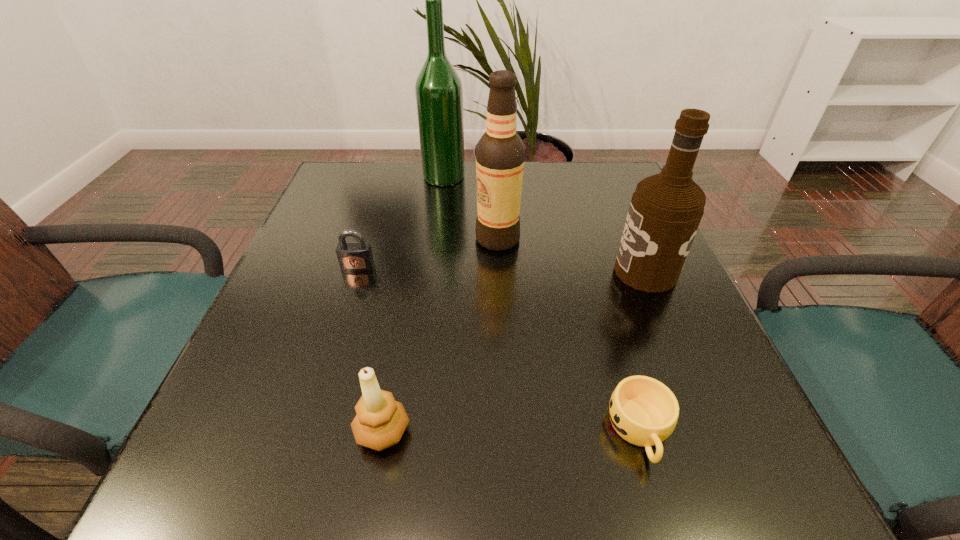
Identify the location of empty space between the second alcohol from right to left and the rightmost alcohol. (571, 255).

Where is `object that is the fifth closest to the cup`? The width and height of the screenshot is (960, 540). object that is the fifth closest to the cup is located at coordinates (438, 88).

Locate an element on the screen. The image size is (960, 540). object identified as the third closest to the leftmost object is located at coordinates pos(380,421).

Image resolution: width=960 pixels, height=540 pixels. I want to click on alcohol that is the second closest to the tallest object, so click(x=666, y=209).

I want to click on the second closest alcohol to the second shortest object, so click(438, 88).

Where is `free point that satisfies the following two spatial constraints: 1. on the back side of the fourth tallest object; 2. on the right side of the farthest object`? The height and width of the screenshot is (540, 960). free point that satisfies the following two spatial constraints: 1. on the back side of the fourth tallest object; 2. on the right side of the farthest object is located at coordinates (427, 176).

This screenshot has width=960, height=540. In order to click on vacant area that satisfies the following two spatial constraints: 1. on the label of the cup; 2. on the left side of the third object from right to left in this screenshot , I will do `click(507, 431)`.

Locate an element on the screen. vacant area in the image that satisfies the following two spatial constraints: 1. on the label of the second alcohol from left to right; 2. on the front side of the candle_holder is located at coordinates click(x=507, y=431).

Where is `free point that satisfies the following two spatial constraints: 1. on the front of the leftmost object near the keyhole; 2. on the left side of the cup`? The width and height of the screenshot is (960, 540). free point that satisfies the following two spatial constraints: 1. on the front of the leftmost object near the keyhole; 2. on the left side of the cup is located at coordinates click(305, 431).

Find the location of `free spot that satisfies the following two spatial constraints: 1. on the label of the fourth object from left to right; 2. on the front of the padlock near the keyhole`. free spot that satisfies the following two spatial constraints: 1. on the label of the fourth object from left to right; 2. on the front of the padlock near the keyhole is located at coordinates (499, 267).